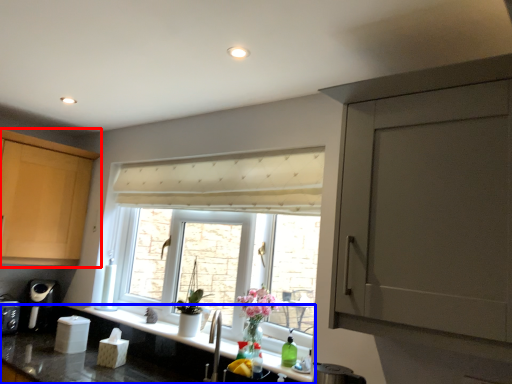
Question: Which point is further to the camera, cabinetry (highlighted by a red box) or countertop (highlighted by a blue box)?

Choices:
 (A) cabinetry
 (B) countertop

Answer: (A)